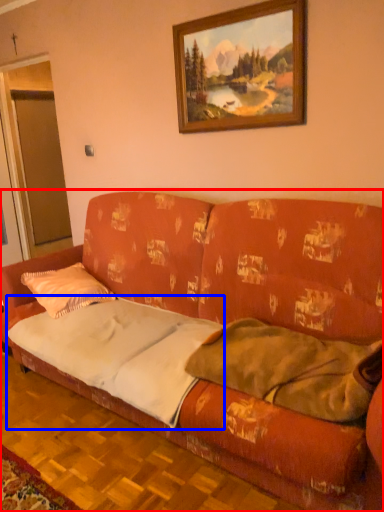
Question: Which of the following is the farthest to the observer, studio couch (highlighted by a red box) or sheet (highlighted by a blue box)?

Choices:
 (A) studio couch
 (B) sheet

Answer: (B)